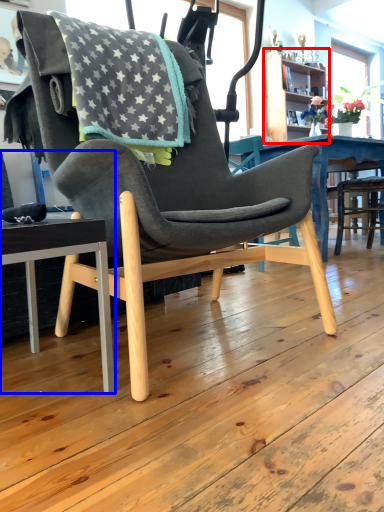
Question: Which point is closer to the camera, bookshelf (highlighted by a red box) or chair (highlighted by a blue box)?

Choices:
 (A) bookshelf
 (B) chair

Answer: (B)